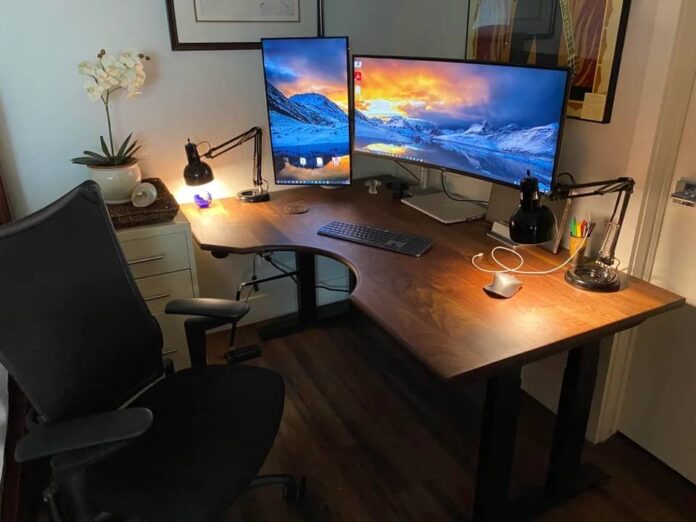
Find the location of a particular element. This screenshot has width=696, height=522. orchid is located at coordinates (109, 72).